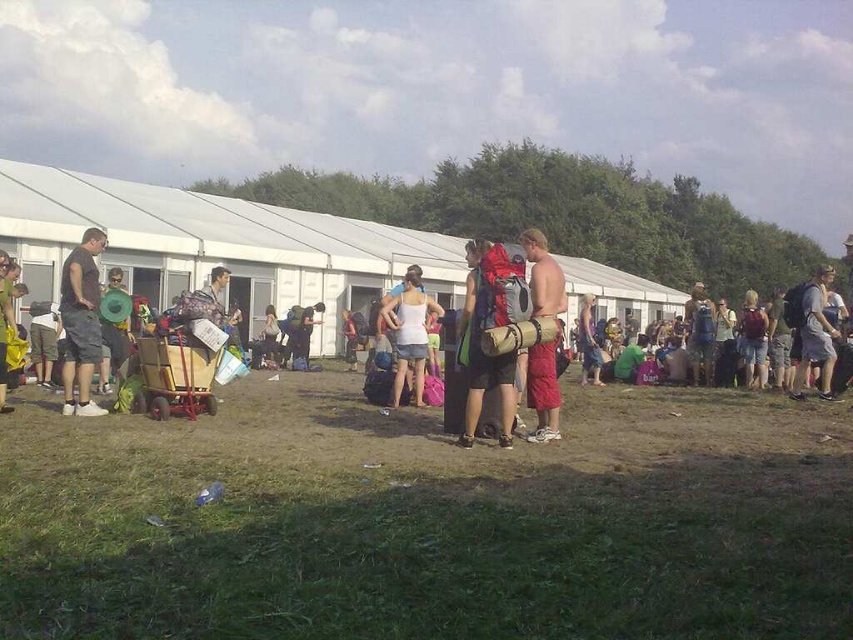
Question: Does brown grass at center come in front of shiny metallic drum at center?

Choices:
 (A) yes
 (B) no

Answer: (A)

Question: Is matte gray backpack at center thinner than matte black backpack at center?

Choices:
 (A) yes
 (B) no

Answer: (B)

Question: Which of the following is the closest to the observer?

Choices:
 (A) (308, 336)
 (B) (572, 417)
 (C) (711, 326)

Answer: (B)

Question: Does brown grass at center come in front of matte black backpack at center?

Choices:
 (A) yes
 (B) no

Answer: (A)

Question: Which object appears farthest from the camera in this image?

Choices:
 (A) camouflage fabric backpack at right
 (B) matte black backpack at center

Answer: (B)

Question: Which object is the closest to the shiny metallic drum at center?

Choices:
 (A) camouflage fabric backpack at right
 (B) matte gray backpack at center

Answer: (B)